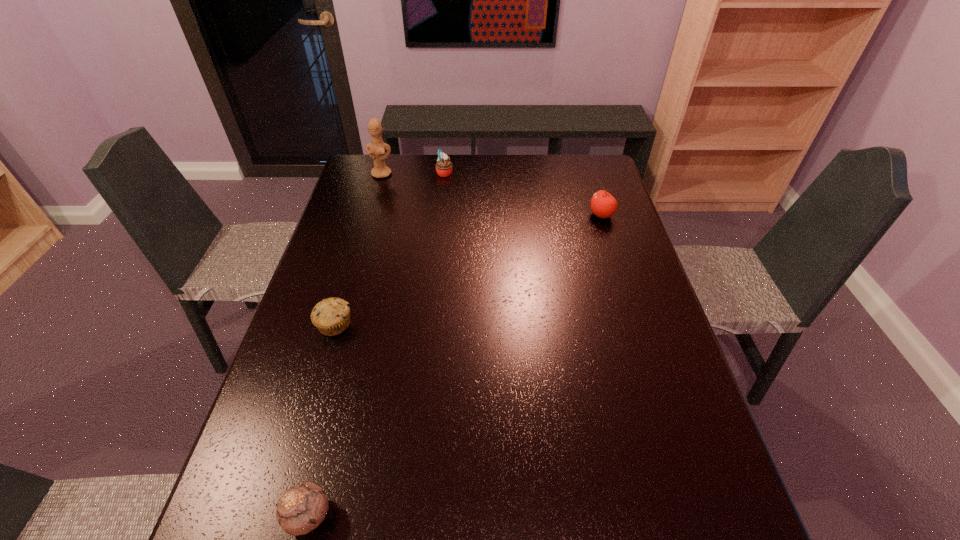
Identify the location of figurine. This screenshot has width=960, height=540. click(x=376, y=149).

Locate an element on the screen. This screenshot has width=960, height=540. the farthest muffin is located at coordinates (443, 166).

Find the location of a particular element. This screenshot has height=540, width=960. the tallest muffin is located at coordinates (443, 166).

Identify the location of the rightmost object. (603, 204).

You are a GUI agent. You are given a task and a screenshot of the screen. Output one action in this format:
    pyautogui.click(x=<x>, y=<y>)
    Task: Click on the apple
    
    Given the screenshot: What is the action you would take?
    pyautogui.click(x=603, y=204)

You are a GUI agent. You are given a task and a screenshot of the screen. Output one action in this format:
    pyautogui.click(x=<x>, y=<y>)
    Task: Click on the second nearest muffin
    The height and width of the screenshot is (540, 960).
    Given the screenshot: What is the action you would take?
    pyautogui.click(x=331, y=316)

At what (x,y) coordinates should I click in order to perform the action: click on free spot located 0.370m on the front-facing side of the tallest object. Please return your answer as a coordinate pair (x, y). Looking at the image, I should click on (361, 246).

The height and width of the screenshot is (540, 960). What are the coordinates of `free spot located on the front-facing side of the farthest muffin` in the screenshot? It's located at (537, 173).

The width and height of the screenshot is (960, 540). I want to click on vacant space situated on the left of the apple, so click(567, 215).

You are a GUI agent. You are given a task and a screenshot of the screen. Output one action in this format:
    pyautogui.click(x=<x>, y=<y>)
    Task: Click on the free space located on the back of the second farthest muffin
    The width and height of the screenshot is (960, 540).
    Given the screenshot: What is the action you would take?
    pyautogui.click(x=364, y=225)